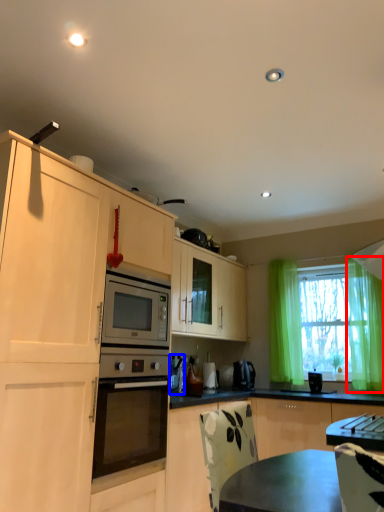
Question: Which object is further to the camera taking this photo, curtain (highlighted by a red box) or appliance (highlighted by a blue box)?

Choices:
 (A) curtain
 (B) appliance

Answer: (B)